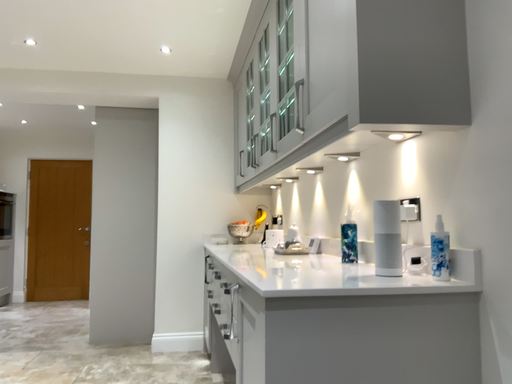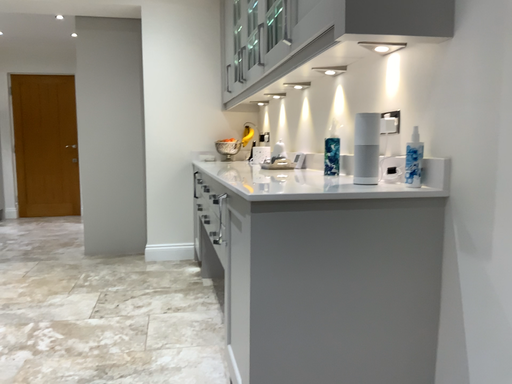
Question: How did the camera likely rotate when shooting the video?

Choices:
 (A) rotated downward
 (B) rotated upward

Answer: (A)